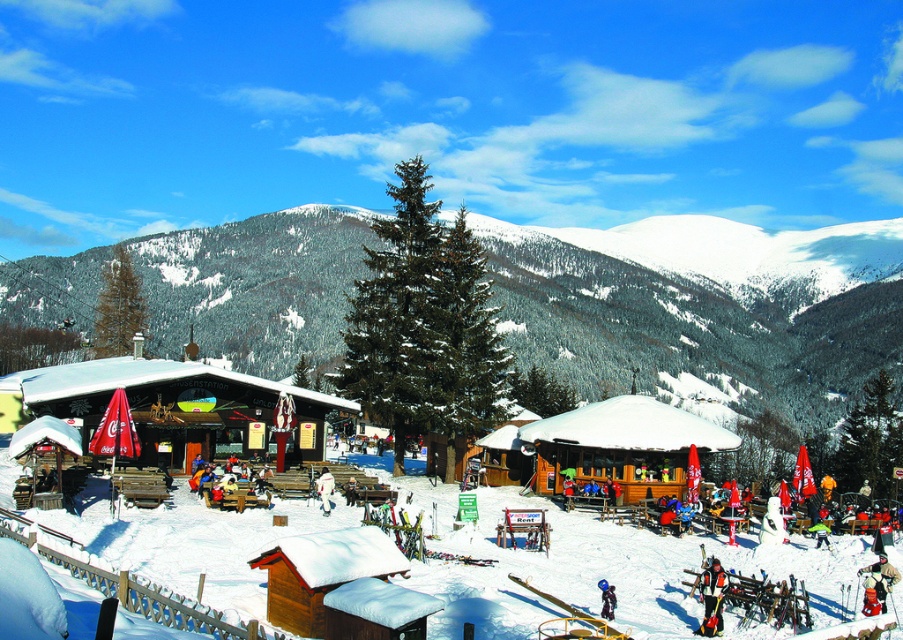
Is wooden bench at lower left bigger than black ski suit at center?

Indeed, wooden bench at lower left has a larger size compared to black ski suit at center.

Is wooden bench at lower left to the left of black ski suit at center from the viewer's perspective?

Indeed, wooden bench at lower left is positioned on the left side of black ski suit at center.

This screenshot has height=640, width=903. What are the coordinates of `wooden bench at lower left` in the screenshot? It's located at (600, 568).

Find the location of a particular element. wooden bench at lower left is located at coordinates (600, 568).

Does wooden bench at lower left appear on the left side of white snowsuit at center?

No, wooden bench at lower left is not to the left of white snowsuit at center.

This screenshot has height=640, width=903. In order to click on wooden bench at lower left in this screenshot , I will do `click(600, 568)`.

Locate an element on the screen. Image resolution: width=903 pixels, height=640 pixels. wooden bench at lower left is located at coordinates (600, 568).

Between wooden cabin at center and black ski suit at center, which one appears on the right side from the viewer's perspective?

Positioned to the right is black ski suit at center.

Who is higher up, wooden cabin at center or black ski suit at center?

wooden cabin at center

What do you see at coordinates (172, 406) in the screenshot? I see `wooden cabin at center` at bounding box center [172, 406].

Identify the location of wooden cabin at center. The height and width of the screenshot is (640, 903). (172, 406).